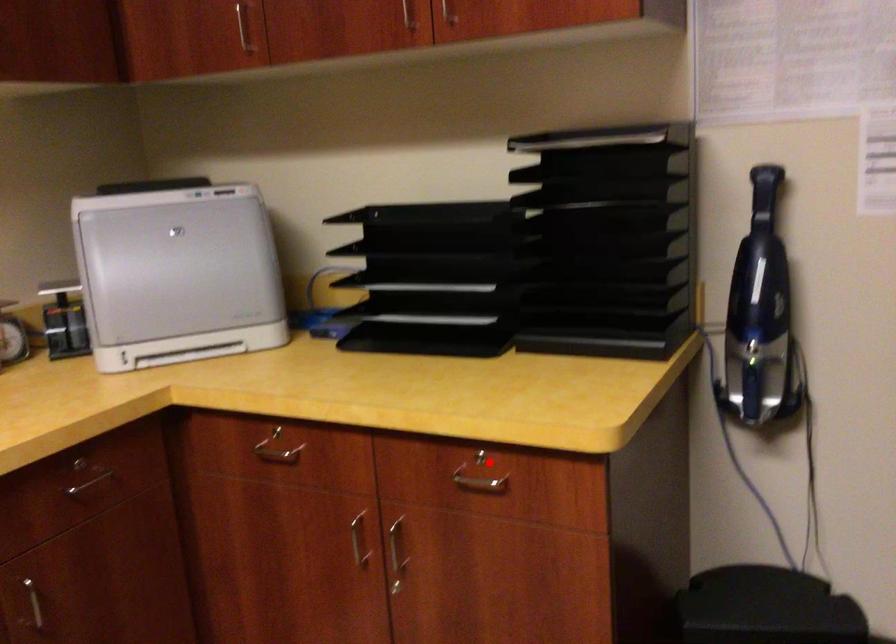
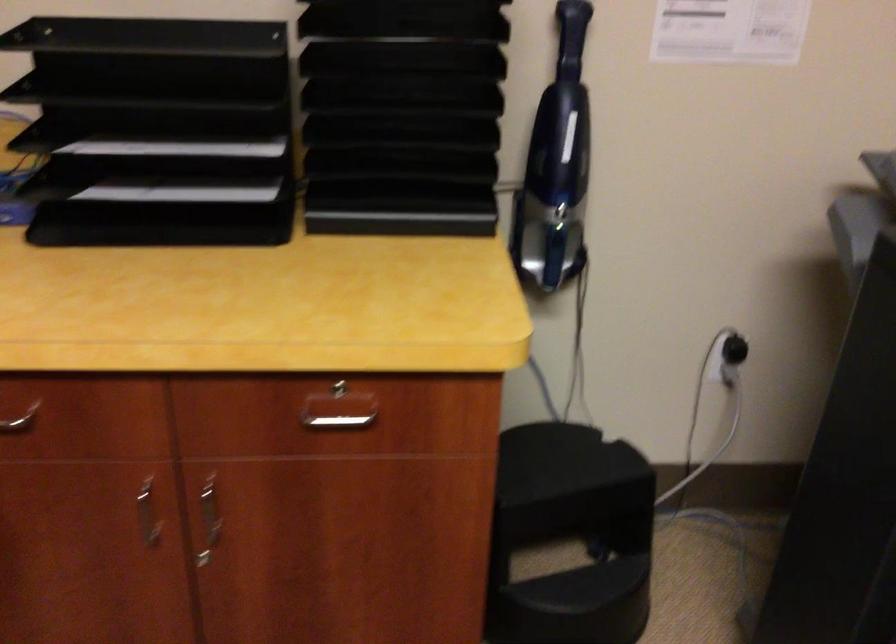
Question: I am providing you with two images of the same scene from different viewpoints. In image1, a red point is highlighted. Considering the same 3D point in image2, which of the following is correct?

Choices:
 (A) It is closer
 (B) It is farther

Answer: (A)